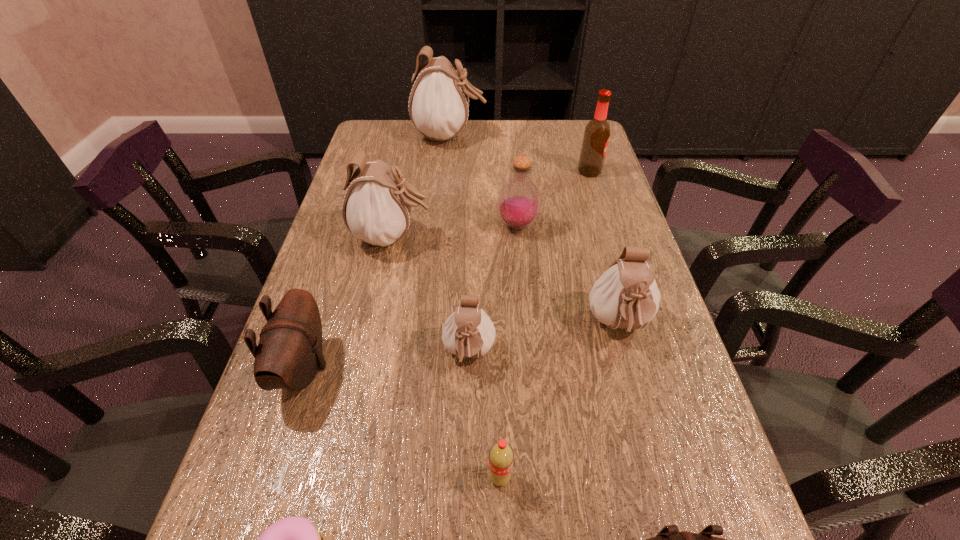
Locate an element on the screen. This screenshot has height=540, width=960. soda is located at coordinates (501, 457).

The height and width of the screenshot is (540, 960). What are the coordinates of `red soda` in the screenshot? It's located at (501, 457).

Locate an element on the screen. vacant space situated 0.370m on the front-facing side of the farthest pouch is located at coordinates (597, 136).

Identify the location of blank space located 0.070m on the front of the second farthest object. The height and width of the screenshot is (540, 960). (596, 192).

The width and height of the screenshot is (960, 540). I want to click on free spot located 0.210m on the front-facing side of the third nearest white pouch, so click(516, 237).

Find the location of a particular element. Image resolution: width=960 pixels, height=540 pixels. free location located on the left of the purple bottle is located at coordinates (442, 225).

Where is `vacant space located 0.090m on the front-facing side of the rightmost white pouch`? The width and height of the screenshot is (960, 540). vacant space located 0.090m on the front-facing side of the rightmost white pouch is located at coordinates (639, 401).

Identify the location of blank area located with the flap open on the bigger brown pouch. This screenshot has width=960, height=540. (396, 368).

Identify the location of free space located 0.080m on the front-facing side of the smallest white pouch. (468, 422).

This screenshot has width=960, height=540. I want to click on vacant area located on the left of the third nearest object, so click(457, 477).